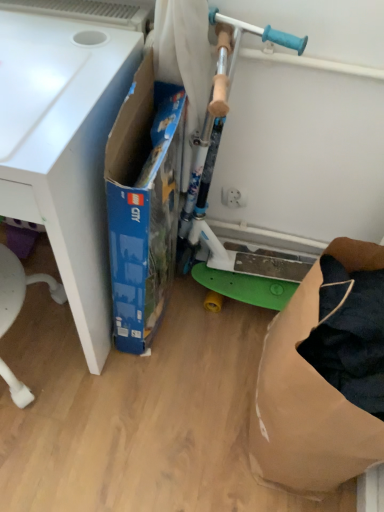
You are a GUI agent. You are given a task and a screenshot of the screen. Output one action in this format:
    pyautogui.click(x=<x>, y=<y>)
    Task: Click on the green plastic scooter at center
    The width and height of the screenshot is (384, 512).
    Given the screenshot: What is the action you would take?
    pos(211,180)

In order to face white matte desk at left, should I rotate leftwards or rightwards?

You should look left and rotate roughly 22.450 degrees.

Where is `white matte desk at left`? white matte desk at left is located at coordinates (64, 149).

This screenshot has height=512, width=384. What do you see at coordinates (305, 411) in the screenshot?
I see `brown paper bag at lower right` at bounding box center [305, 411].

In order to face blue cardboard box at center, should I rotate leftwards or rightwards?

A 5.976 degree turn to the left will do.

Identify the location of green plastic scooter at center. (211, 180).

Is white matte desk at left turned away from blue cardboard box at center?

That's not correct — white matte desk at left is not looking away from blue cardboard box at center.

In terms of width, does white matte desk at left look wider or thinner when compared to blue cardboard box at center?

In the image, white matte desk at left appears to be wider than blue cardboard box at center.

Is white matte desk at left far from blue cardboard box at center?

No, white matte desk at left is in close proximity to blue cardboard box at center.

Is white matte desk at left not inside blue cardboard box at center?

Yes, white matte desk at left is not within blue cardboard box at center.

Is white matte desk at left in front of or behind green plastic scooter at center in the image?

white matte desk at left is in front of green plastic scooter at center.

From the image's perspective, which is below, white matte desk at left or green plastic scooter at center?

green plastic scooter at center, from the image's perspective.

Looking at this image, which object is wider, white matte desk at left or green plastic scooter at center?

white matte desk at left is wider.

Is brown paper bag at lower right next to green plastic scooter at center and touching it?

brown paper bag at lower right and green plastic scooter at center are not in contact.

How distant is brown paper bag at lower right from green plastic scooter at center?

The distance of brown paper bag at lower right from green plastic scooter at center is 17.47 inches.

From the picture: Is brown paper bag at lower right in front of green plastic scooter at center?

Yes, brown paper bag at lower right is closer to the camera.

Which is less distant, [366,246] or [220,247]?

The point [366,246] is closer to the camera.

Is brown paper bag at lower right shorter than blue cardboard box at center?

Yes.

From the image's perspective, is brown paper bag at lower right below blue cardboard box at center?

Yes.

Is point (297, 372) farther from camera compared to point (178, 127)?

No, it is not.

Is brown paper bag at lower right completely or partially outside of blue cardboard box at center?

Yes, brown paper bag at lower right is outside of blue cardboard box at center.

Considering the sizes of objects green plastic scooter at center and blue cardboard box at center in the image provided, who is smaller, green plastic scooter at center or blue cardboard box at center?

blue cardboard box at center.

From the picture: What's the angular difference between green plastic scooter at center and blue cardboard box at center's facing directions?

green plastic scooter at center and blue cardboard box at center are facing 91.8 degrees away from each other.

This screenshot has height=512, width=384. In order to click on appliance that appears above the blue cardboard box at center (from a real-world perspective) in this screenshot , I will do `click(211, 180)`.

From a real-world perspective, who is located higher, green plastic scooter at center or brown paper bag at lower right?

green plastic scooter at center.

Who is smaller, green plastic scooter at center or brown paper bag at lower right?

brown paper bag at lower right.

Does point (215, 237) come farther from viewer compared to point (312, 493)?

Yes.

Locate an element on the screen. This screenshot has height=512, width=384. box behind the brown paper bag at lower right is located at coordinates (143, 205).

Can you confirm if blue cardboard box at center is positioned to the right of brown paper bag at lower right?

No.

How much distance is there between blue cardboard box at center and brown paper bag at lower right?

blue cardboard box at center is 17.11 inches from brown paper bag at lower right.

Is point (167, 257) farther from viewer compared to point (273, 463)?

Yes.

The height and width of the screenshot is (512, 384). I want to click on box that is below the white matte desk at left (from the image's perspective), so click(143, 205).

At what (x,y) coordinates should I click in order to perform the action: click on desk located in front of the green plastic scooter at center. Please return your answer as a coordinate pair (x, y). The width and height of the screenshot is (384, 512). Looking at the image, I should click on (64, 149).

Considering their positions, is green plastic scooter at center positioned further to brown paper bag at lower right than blue cardboard box at center?

green plastic scooter at center is positioned further to the anchor brown paper bag at lower right.

Based on the photo, based on their spatial positions, is blue cardboard box at center or white matte desk at left further from brown paper bag at lower right?

white matte desk at left lies further to brown paper bag at lower right than the other object.

Looking at the image, which one is located further to green plastic scooter at center, blue cardboard box at center or brown paper bag at lower right?

brown paper bag at lower right lies further to green plastic scooter at center than the other object.

From the image, which object appears to be farther from blue cardboard box at center, brown paper bag at lower right or white matte desk at left?

brown paper bag at lower right is further to blue cardboard box at center.

Looking at the image, which one is located closer to brown paper bag at lower right, green plastic scooter at center or white matte desk at left?

green plastic scooter at center lies closer to brown paper bag at lower right than the other object.

When comparing their distances from white matte desk at left, does blue cardboard box at center or green plastic scooter at center seem closer?

blue cardboard box at center is closer to white matte desk at left.

From the image, which object appears to be farther from brown paper bag at lower right, blue cardboard box at center or green plastic scooter at center?

green plastic scooter at center lies further to brown paper bag at lower right than the other object.

Looking at this image, when comparing their distances from green plastic scooter at center, does white matte desk at left or brown paper bag at lower right seem closer?

white matte desk at left lies closer to green plastic scooter at center than the other object.

Find the location of a particular element. box between white matte desk at left and brown paper bag at lower right from left to right is located at coordinates (143, 205).

Locate an element on the screen. This screenshot has height=512, width=384. appliance located between blue cardboard box at center and brown paper bag at lower right in the left-right direction is located at coordinates (211, 180).

Identify the location of box located between white matte desk at left and green plastic scooter at center in the left-right direction. The height and width of the screenshot is (512, 384). tap(143, 205).

Find the location of a particular element. The height and width of the screenshot is (512, 384). appliance situated between white matte desk at left and brown paper bag at lower right from left to right is located at coordinates (211, 180).